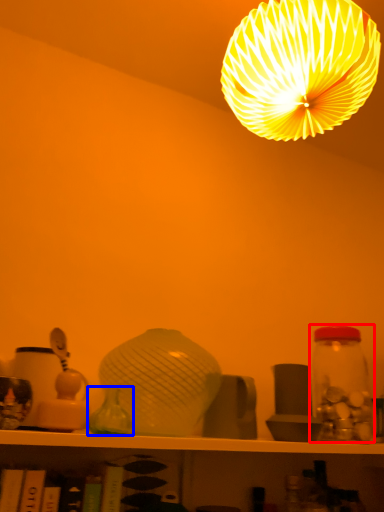
Question: Among these objects, which one is farthest to the camera, glass jar (highlighted by a red box) or glass vase (highlighted by a blue box)?

Choices:
 (A) glass jar
 (B) glass vase

Answer: (A)